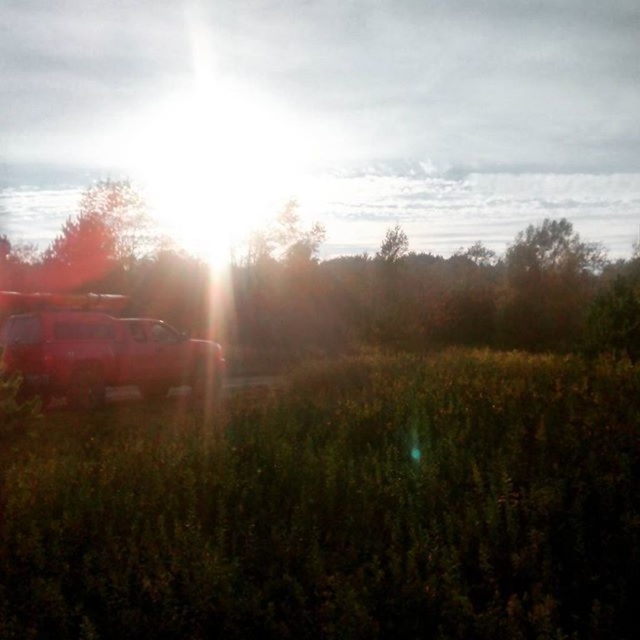
Question: Among these points, which one is farthest from the camera?

Choices:
 (A) (292, 611)
 (B) (134, 337)
 (C) (515, 196)

Answer: (C)

Question: Estimate the real-world distances between objects in this image. Which object is closer to the green leafy tree at left?

Choices:
 (A) green grass at lower left
 (B) shiny red jeep at left

Answer: (A)

Question: Is green leafy tree at left wider than shiny red jeep at left?

Choices:
 (A) yes
 (B) no

Answer: (A)

Question: Can you confirm if green grass at lower left is smaller than green leafy tree at left?

Choices:
 (A) yes
 (B) no

Answer: (A)

Question: Which point is closer to the camera?

Choices:
 (A) shiny red jeep at left
 (B) green leafy tree at left

Answer: (A)

Question: Can you confirm if green grass at lower left is bigger than shiny red jeep at left?

Choices:
 (A) no
 (B) yes

Answer: (A)